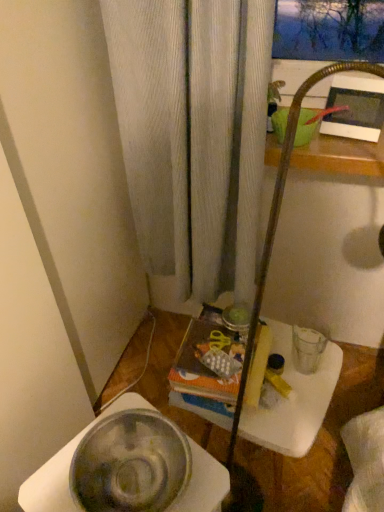
Question: From a real-world perspective, does metallic silver bowl at lower left, which is the first basin from bottom to top, stand above green matte basin at upper right, positioned as the second basin in left-to-right order?

Choices:
 (A) yes
 (B) no

Answer: (B)

Question: Is metallic silver bowl at lower left, the 1th basin viewed from the left, wider than green matte basin at upper right, which ranks as the 1th basin in back-to-front order?

Choices:
 (A) no
 (B) yes

Answer: (B)

Question: Is metallic silver bowl at lower left, acting as the 1th basin starting from the front, closer to the viewer compared to green matte basin at upper right, which ranks as the 2th basin in front-to-back order?

Choices:
 (A) yes
 (B) no

Answer: (A)

Question: From a real-world perspective, is metallic silver bowl at lower left, which appears as the 2th basin when viewed from the right, below green matte basin at upper right, acting as the second basin starting from the bottom?

Choices:
 (A) yes
 (B) no

Answer: (A)

Question: Can you confirm if metallic silver bowl at lower left, which appears as the second basin when viewed from the top, is thinner than green matte basin at upper right, the first basin from the right?

Choices:
 (A) no
 (B) yes

Answer: (A)

Question: Relative to clear plastic table at center, is green matte basin at upper right, acting as the second basin starting from the bottom, in front or behind?

Choices:
 (A) front
 (B) behind

Answer: (B)

Question: In terms of height, does green matte basin at upper right, acting as the second basin starting from the bottom, look taller or shorter compared to clear plastic table at center?

Choices:
 (A) short
 (B) tall

Answer: (A)

Question: Would you say green matte basin at upper right, positioned as the second basin in left-to-right order, is to the left or to the right of clear plastic table at center in the picture?

Choices:
 (A) left
 (B) right

Answer: (B)

Question: Is green matte basin at upper right, acting as the second basin starting from the bottom, bigger or smaller than clear plastic table at center?

Choices:
 (A) small
 (B) big

Answer: (A)

Question: Considering the relative positions of clear plastic table at center and green matte basin at upper right, acting as the second basin starting from the bottom, in the image provided, is clear plastic table at center to the left or to the right of green matte basin at upper right, acting as the second basin starting from the bottom,?

Choices:
 (A) right
 (B) left

Answer: (B)

Question: Looking at the image, does clear plastic table at center seem bigger or smaller compared to green matte basin at upper right, which ranks as the 2th basin in front-to-back order?

Choices:
 (A) small
 (B) big

Answer: (B)

Question: In terms of width, does clear plastic table at center look wider or thinner when compared to green matte basin at upper right, which ranks as the 2th basin in front-to-back order?

Choices:
 (A) wide
 (B) thin

Answer: (A)

Question: From a real-world perspective, is clear plastic table at center positioned above or below green matte basin at upper right, positioned as the second basin in left-to-right order?

Choices:
 (A) above
 (B) below

Answer: (B)

Question: Considering the positions of metallic silver bowl at lower left, acting as the 1th basin starting from the front, and clear plastic table at center in the image, is metallic silver bowl at lower left, acting as the 1th basin starting from the front, bigger or smaller than clear plastic table at center?

Choices:
 (A) big
 (B) small

Answer: (B)

Question: Considering the positions of metallic silver bowl at lower left, which appears as the 2th basin when viewed from the right, and clear plastic table at center in the image, is metallic silver bowl at lower left, which appears as the 2th basin when viewed from the right, wider or thinner than clear plastic table at center?

Choices:
 (A) thin
 (B) wide

Answer: (A)